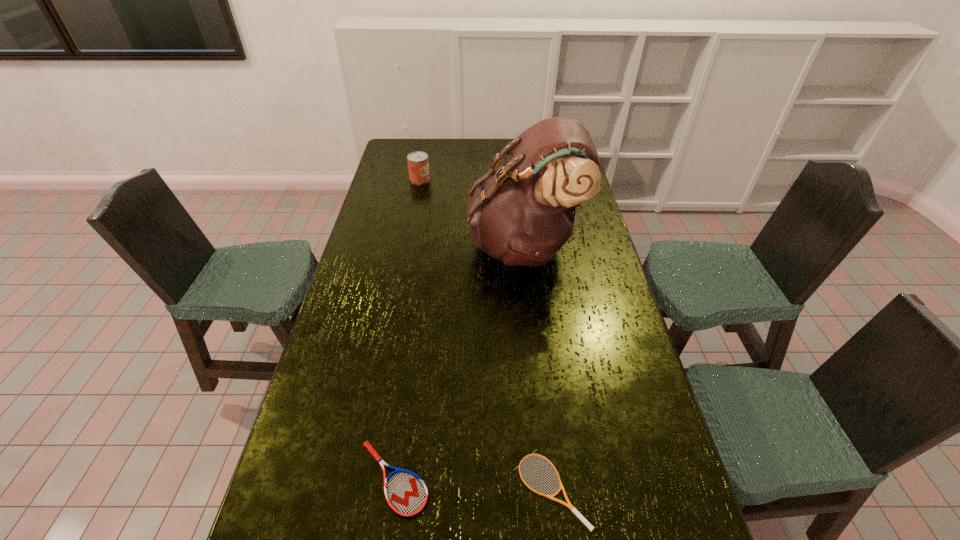
Where is `empty space between the shorter tennis racket and the left tennis racket`? empty space between the shorter tennis racket and the left tennis racket is located at coordinates (472, 483).

Find the location of a particular element. This screenshot has width=960, height=540. vacant space in between the left tennis racket and the second tallest object is located at coordinates point(407,328).

At what (x,y) coordinates should I click in order to perform the action: click on vacant space that is in between the tallest object and the left tennis racket. Please return your answer as a coordinate pair (x, y). Looking at the image, I should click on pos(459,362).

At what (x,y) coordinates should I click in order to perform the action: click on empty space between the shorter tennis racket and the left tennis racket. Please return your answer as a coordinate pair (x, y). The width and height of the screenshot is (960, 540). Looking at the image, I should click on (472, 483).

Choose which object is the second nearest neighbor to the shorter tennis racket. Please provide its 2D coordinates. Your answer should be formatted as a tuple, i.e. [(x, y)], where the tuple contains the x and y coordinates of a point satisfying the conditions above.

[(522, 213)]

Where is `object identified as the second closest to the right tennis racket`? This screenshot has height=540, width=960. object identified as the second closest to the right tennis racket is located at coordinates (522, 213).

Where is `vacant space that satisfies the following two spatial constraints: 1. on the front side of the shorter tennis racket; 2. on the right side of the third shortest object`? This screenshot has width=960, height=540. vacant space that satisfies the following two spatial constraints: 1. on the front side of the shorter tennis racket; 2. on the right side of the third shortest object is located at coordinates (360, 489).